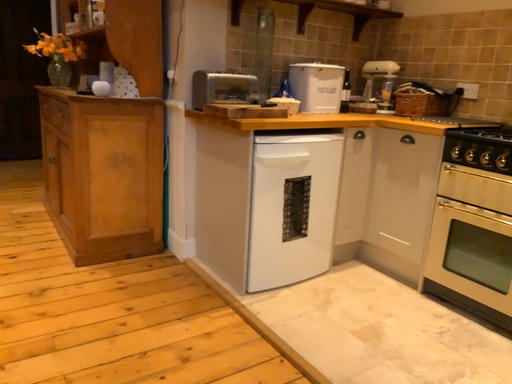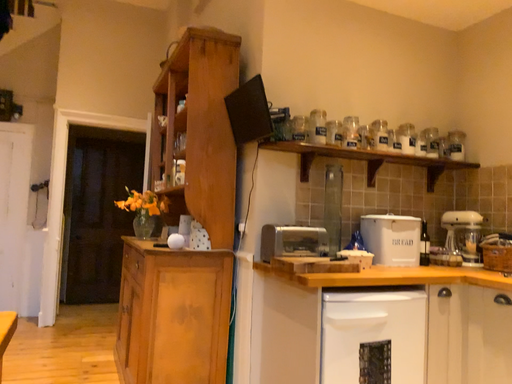
Question: How did the camera likely rotate when shooting the video?

Choices:
 (A) rotated right
 (B) rotated left

Answer: (B)